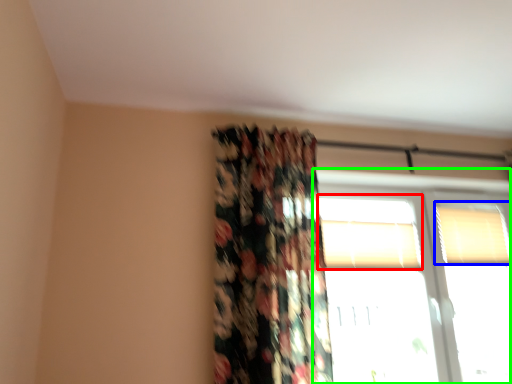
Question: Which object is positioned farthest from window (highlighted by a red box)? Select from window (highlighted by a blue box) and window (highlighted by a green box).

Choices:
 (A) window
 (B) window

Answer: (A)